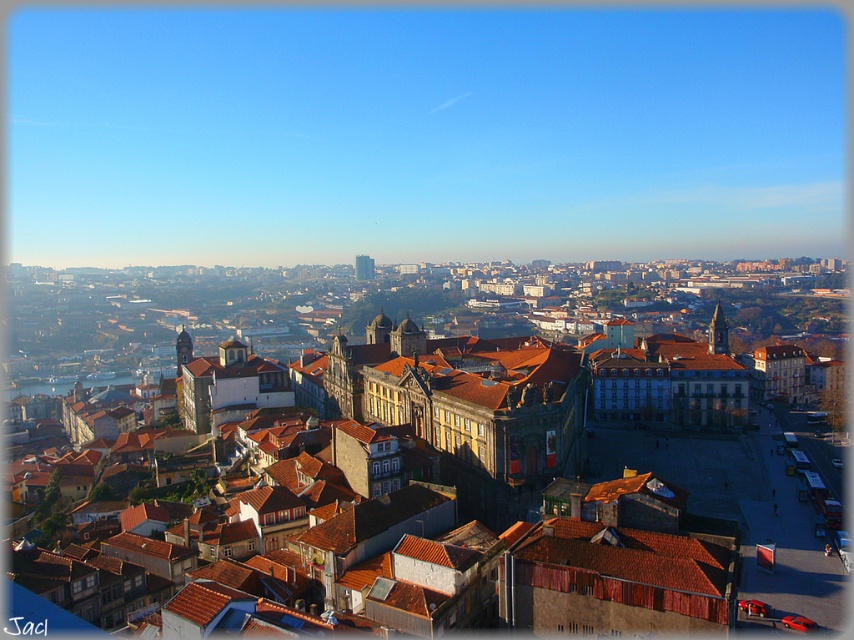
Between matte stone tower at center and smooth stone tower at center, which one appears on the right side from the viewer's perspective?

From the viewer's perspective, smooth stone tower at center appears more on the right side.

Can you confirm if matte stone tower at center is taller than smooth stone tower at center?

Incorrect, matte stone tower at center's height is not larger of smooth stone tower at center's.

This screenshot has height=640, width=854. I want to click on matte stone tower at center, so click(182, 349).

Looking at this image, is brown stone tower at center closer to the viewer compared to matte stone tower at center?

Yes.

Describe the element at coordinates (717, 332) in the screenshot. I see `brown stone tower at center` at that location.

I want to click on brown stone tower at center, so click(717, 332).

Measure the distance from brown stone tower at center to smooth stone tower at center.

brown stone tower at center is 271.91 meters from smooth stone tower at center.

You are a GUI agent. You are given a task and a screenshot of the screen. Output one action in this format:
    pyautogui.click(x=<x>, y=<y>)
    Task: Click on the brown stone tower at center
    The width and height of the screenshot is (854, 640).
    Given the screenshot: What is the action you would take?
    pyautogui.click(x=717, y=332)